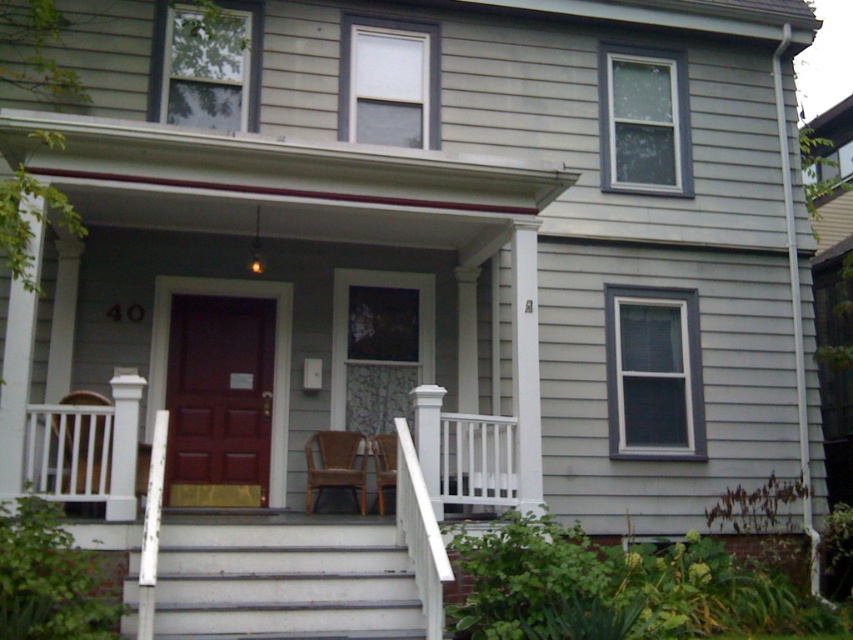
Question: Which point is farther to the camera?

Choices:
 (A) white painted wood stairs at lower center
 (B) white painted wood post at center
 (C) wooden chair at lower center
 (D) white wooden rail at lower left

Answer: (C)

Question: Which object is closer to the camera taking this photo?

Choices:
 (A) white wooden rail at lower left
 (B) wooden chair at lower center
 (C) white wooden chair at lower left
 (D) brown woven chair at center

Answer: (A)

Question: Is white wooden rail at lower left further to camera compared to wooden chair at lower center?

Choices:
 (A) no
 (B) yes

Answer: (A)

Question: Which of the following is the closest to the observer?

Choices:
 (A) (422, 465)
 (B) (383, 449)

Answer: (A)

Question: Is white painted wood stairs at lower center closer to the viewer compared to brown woven chair at center?

Choices:
 (A) no
 (B) yes

Answer: (B)

Question: Does white painted wood post at center come in front of white wooden chair at lower left?

Choices:
 (A) yes
 (B) no

Answer: (A)